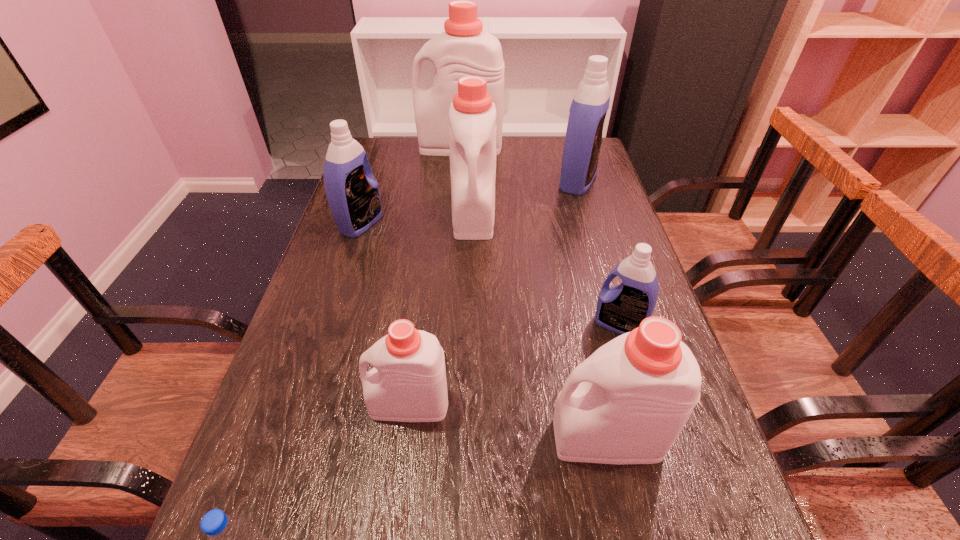
I want to click on free space between the biggest blue detergent and the fourth nearest object, so click(x=598, y=253).

The image size is (960, 540). In order to click on free space between the tallest detergent and the smallest white detergent in this screenshot , I will do `click(435, 275)`.

This screenshot has width=960, height=540. I want to click on free spot between the farthest blue detergent and the second smallest white detergent, so click(x=592, y=309).

You are a GUI agent. You are given a task and a screenshot of the screen. Output one action in this format:
    pyautogui.click(x=<x>, y=<y>)
    Task: Click on the vacant point located between the smallest white detergent and the second farthest white detergent
    This screenshot has height=540, width=960.
    Given the screenshot: What is the action you would take?
    pyautogui.click(x=442, y=309)

Locate an element on the screen. The image size is (960, 540). free space between the leftmost blue detergent and the smallest white detergent is located at coordinates (385, 314).

Image resolution: width=960 pixels, height=540 pixels. What are the coordinates of `vacant area that lies between the farthest blue detergent and the farthest detergent` in the screenshot? It's located at (518, 164).

Where is `free space between the smallest white detergent and the rightmost white detergent`? This screenshot has width=960, height=540. free space between the smallest white detergent and the rightmost white detergent is located at coordinates (508, 421).

This screenshot has height=540, width=960. In order to click on vacant area between the rightmost white detergent and the biggest blue detergent in this screenshot , I will do `click(592, 309)`.

Locate an element on the screen. vacant point located between the fifth farthest object and the biggest blue detergent is located at coordinates (598, 253).

You are a GUI agent. You are given a task and a screenshot of the screen. Output one action in this format:
    pyautogui.click(x=<x>, y=<y>)
    Task: Click on the object that is the seventh closest one to the rightmost white detergent
    
    Given the screenshot: What is the action you would take?
    pyautogui.click(x=464, y=49)